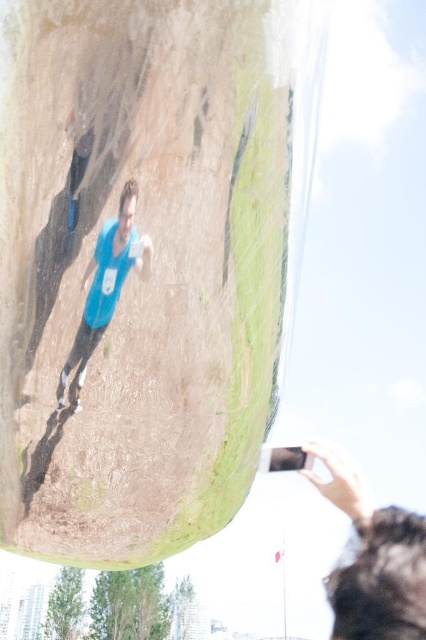
You are standing at the point closest to the camera in the image. Which point, point (204, 371) or point (92, 266), is farther away from you?

Point (204, 371) is behind point (92, 266), so it is farther away from you.

You are standing in front of the rock face and see two points marked on it. Which point is closer to you, point [351,592] or point [97,284]?

Point [351,592] is further to the viewer than point [97,284], so point [97,284] is closer to you.